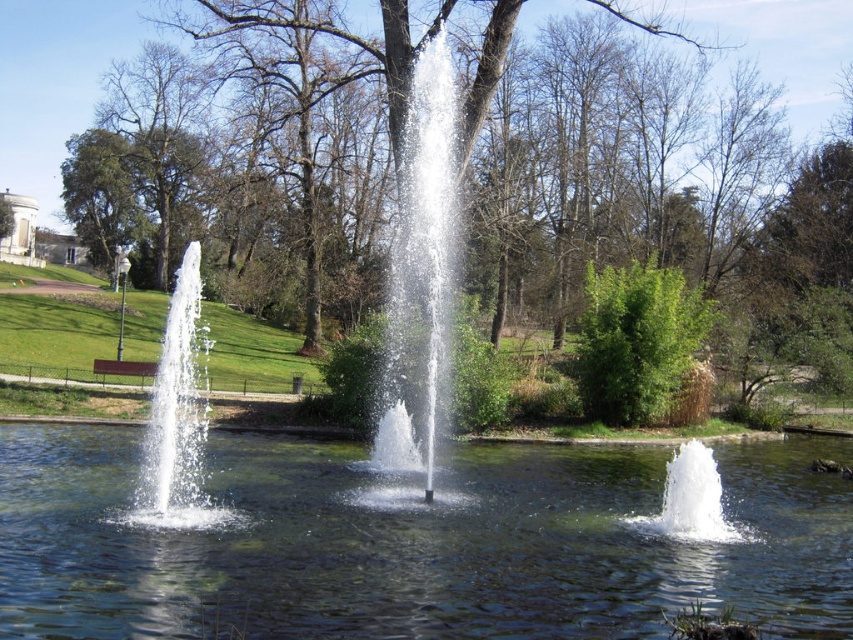
Who is more distant from viewer, (10, 486) or (718, 532)?

The point (10, 486) is more distant.

Identify the location of clear water at center. (415, 541).

Image resolution: width=853 pixels, height=640 pixels. I want to click on clear water at center, so click(x=415, y=541).

Which is in front, point (444, 257) or point (171, 461)?

Positioned in front is point (171, 461).

Looking at this image, is clear water fountain at center thinner than clear water fountain at left?

Yes.

At what (x,y) coordinates should I click in order to perform the action: click on clear water fountain at center. Please return your answer as a coordinate pair (x, y). The height and width of the screenshot is (640, 853). Looking at the image, I should click on (421, 276).

Which is more to the left, clear water at center or green leafy tree at center?

From the viewer's perspective, green leafy tree at center appears more on the left side.

Who is shorter, clear water at center or green leafy tree at center?

clear water at center

I want to click on clear water at center, so click(415, 541).

Locate an element on the screen. clear water at center is located at coordinates (415, 541).